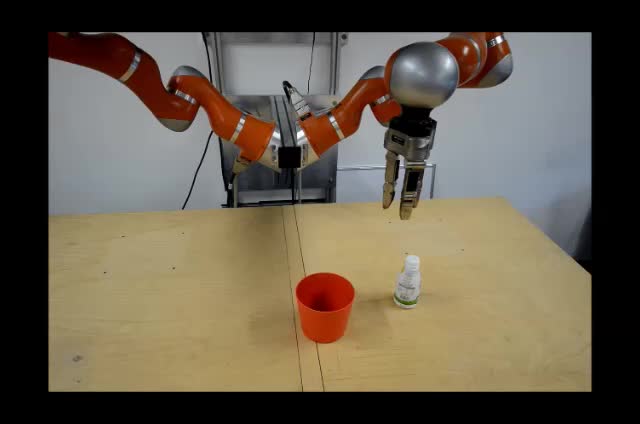
Identify the location of cup. (317, 320).